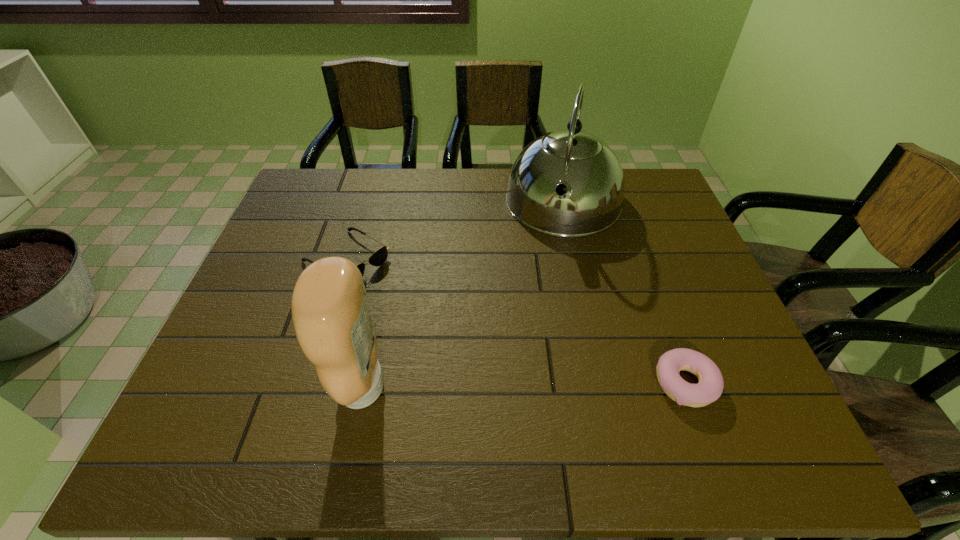
Identify the location of free space located 0.280m from the spout of the kettle. (540, 318).

The height and width of the screenshot is (540, 960). I want to click on vacant space situated from the spout of the kettle, so click(x=552, y=262).

Locate an element on the screen. The image size is (960, 540). blank area located from the spout of the kettle is located at coordinates (547, 280).

Where is `object located at the far edge`? The image size is (960, 540). object located at the far edge is located at coordinates (578, 165).

This screenshot has width=960, height=540. Identify the location of condiment that is at the near edge. (330, 313).

The image size is (960, 540). I want to click on doughnut located at the near edge, so click(709, 389).

You are a GUI agent. You are given a task and a screenshot of the screen. Output one action in this format:
    pyautogui.click(x=<x>, y=<y>)
    Task: Click on the object that is at the left edge
    
    Given the screenshot: What is the action you would take?
    pyautogui.click(x=379, y=257)

The width and height of the screenshot is (960, 540). I want to click on doughnut present at the right edge, so click(x=709, y=389).

Find the location of `kettle present at the right edge`. kettle present at the right edge is located at coordinates (578, 165).

Where is `object at the far right corner`? The width and height of the screenshot is (960, 540). object at the far right corner is located at coordinates (578, 165).